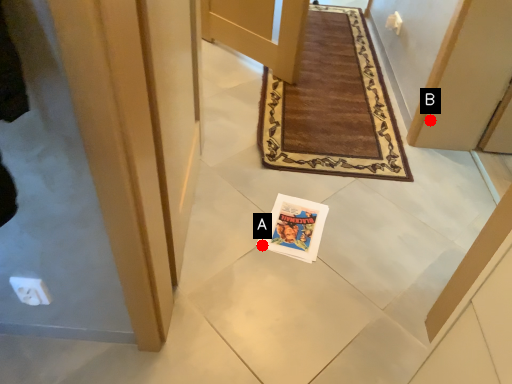
Question: Two points are circled on the image, labeled by A and B beside each circle. Which point is closer to the camera?

Choices:
 (A) A is closer
 (B) B is closer

Answer: (A)